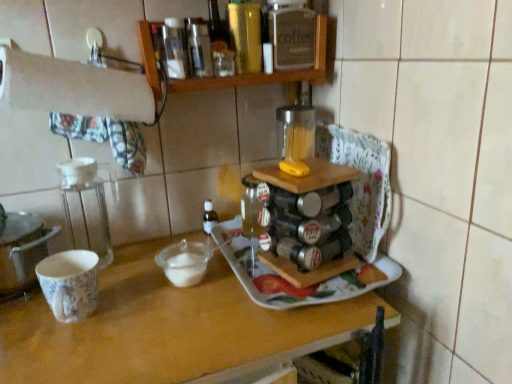
The width and height of the screenshot is (512, 384). I want to click on free space to the back side of transparent glass mixing bowl at center, so click(x=188, y=243).